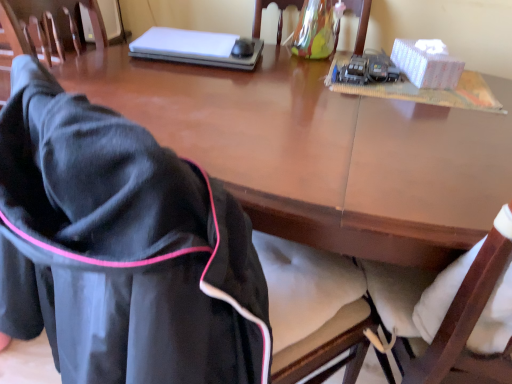
Locate an element on the screen. vacant point above white matte laptop at upper center (from a real-world perspective) is located at coordinates (204, 44).